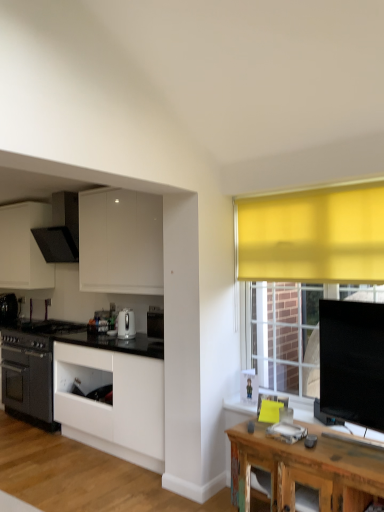
Question: Considering the relative positions of rustic wood table at lower right and matte black range hood at upper left, which is the second kitchen appliance from left to right, in the image provided, is rustic wood table at lower right to the left or to the right of matte black range hood at upper left, which is the second kitchen appliance from left to right,?

Choices:
 (A) right
 (B) left

Answer: (A)

Question: From a real-world perspective, is rustic wood table at lower right above or below matte black range hood at upper left, the 3th kitchen appliance ordered from the bottom?

Choices:
 (A) above
 (B) below

Answer: (B)

Question: Which object is positioned closest to the rustic wood table at lower right?

Choices:
 (A) black matte oven at left, the third kitchen appliance viewed from the top
 (B) matte black range hood at upper left, the 2th kitchen appliance from the front
 (C) white glossy kettle at center, the third kitchen appliance in the left-to-right sequence
 (D) white glossy cabinet at center, marked as the second cabinetry in a left-to-right arrangement
 (E) white matte cabinet at upper left, arranged as the first cabinetry when viewed from the left

Answer: (D)

Question: Which object is positioned closest to the white glossy kettle at center, the 2th kitchen appliance in the top-to-bottom sequence?

Choices:
 (A) black matte oven at left, acting as the third kitchen appliance starting from the right
 (B) rustic wood table at lower right
 (C) white matte cabinet at upper left, arranged as the first cabinetry when viewed from the left
 (D) matte black range hood at upper left, the 2th kitchen appliance from the front
 (E) white glossy cabinet at center, which is the 1th cabinetry from right to left

Answer: (E)